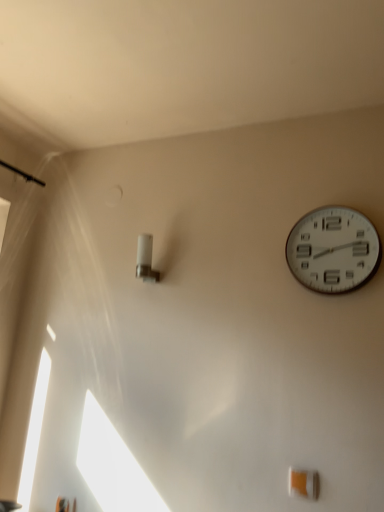
Question: Considering the positions of white plastic wall clock at upper right and white plastic light fixture at center-left in the image, is white plastic wall clock at upper right bigger or smaller than white plastic light fixture at center-left?

Choices:
 (A) big
 (B) small

Answer: (A)

Question: Visually, is white plastic wall clock at upper right positioned to the left or to the right of white plastic light fixture at center-left?

Choices:
 (A) right
 (B) left

Answer: (A)

Question: Relative to white plastic light fixture at center-left, is white plastic wall clock at upper right in front or behind?

Choices:
 (A) behind
 (B) front

Answer: (B)

Question: Considering the positions of white plastic light fixture at center-left and white plastic wall clock at upper right in the image, is white plastic light fixture at center-left wider or thinner than white plastic wall clock at upper right?

Choices:
 (A) thin
 (B) wide

Answer: (B)

Question: From the image's perspective, is white plastic light fixture at center-left located above or below white plastic wall clock at upper right?

Choices:
 (A) below
 (B) above

Answer: (A)

Question: Is point (145, 272) positioned closer to the camera than point (352, 224)?

Choices:
 (A) closer
 (B) farther

Answer: (B)

Question: Would you say white plastic light fixture at center-left is to the left or to the right of white plastic wall clock at upper right in the picture?

Choices:
 (A) right
 (B) left

Answer: (B)